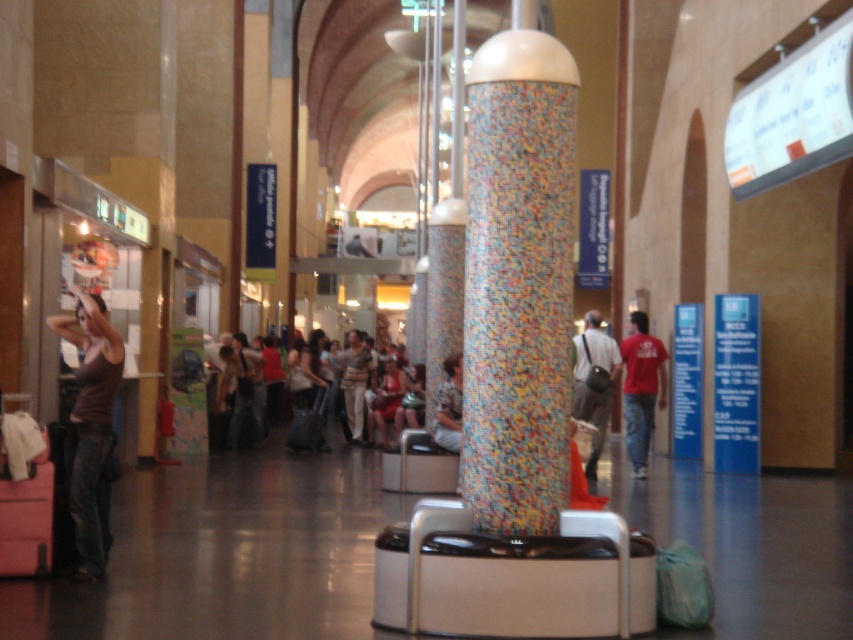
Between matte white shirt at center and matte gray backpack at center, which one appears on the left side from the viewer's perspective?

From the viewer's perspective, matte white shirt at center appears more on the left side.

Who is lower down, matte white shirt at center or matte gray backpack at center?

matte white shirt at center is lower down.

Where is `matte white shirt at center`? The height and width of the screenshot is (640, 853). matte white shirt at center is located at coordinates (248, 388).

What are the coordinates of `matte white shirt at center` in the screenshot? It's located at (248, 388).

Which of these two, mosaic tile column at center or matte brown tank top at left, stands taller?

With more height is mosaic tile column at center.

Identify the location of mosaic tile column at center. This screenshot has height=640, width=853. (518, 280).

The height and width of the screenshot is (640, 853). What do you see at coordinates (518, 280) in the screenshot?
I see `mosaic tile column at center` at bounding box center [518, 280].

Where is `mosaic tile column at center`? The height and width of the screenshot is (640, 853). mosaic tile column at center is located at coordinates (518, 280).

Who is shorter, mosaic tile column at center or red cotton t-shirt at center?

With less height is red cotton t-shirt at center.

Is point (473, 99) in front of point (631, 444)?

Yes.

Between point (555, 38) and point (650, 390), which one is positioned behind?

Positioned behind is point (650, 390).

Find the location of a particular element. This screenshot has height=640, width=853. mosaic tile column at center is located at coordinates 518,280.